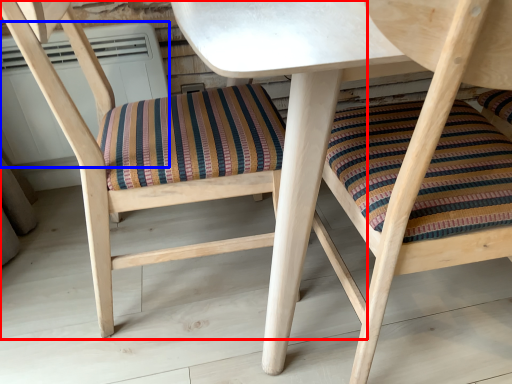
Question: Which object is further to the camera taking this photo, chair (highlighted by a red box) or air conditioner (highlighted by a blue box)?

Choices:
 (A) chair
 (B) air conditioner

Answer: (B)